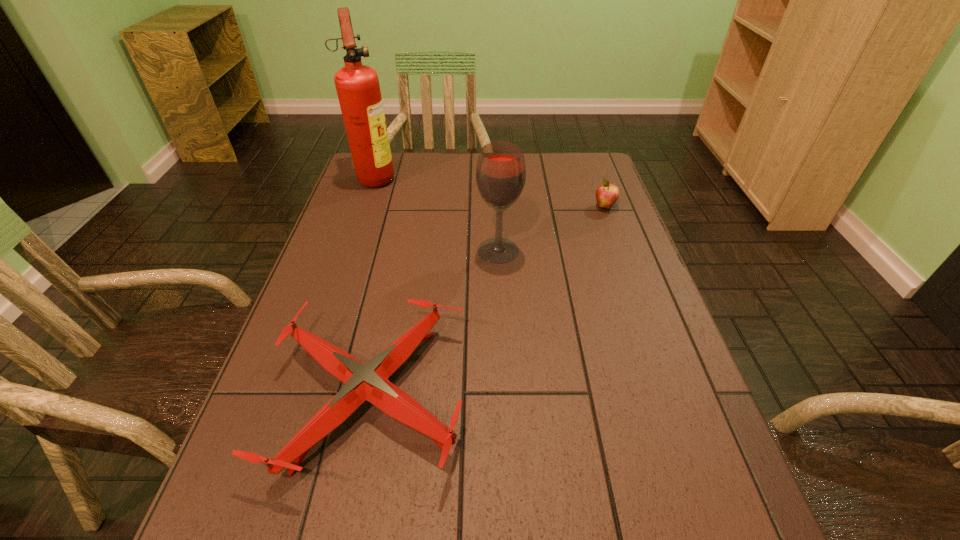
I want to click on vacant position in the image that satisfies the following two spatial constraints: 1. on the back side of the third farthest object; 2. on the front-facing side of the fire extinguisher, so click(x=494, y=177).